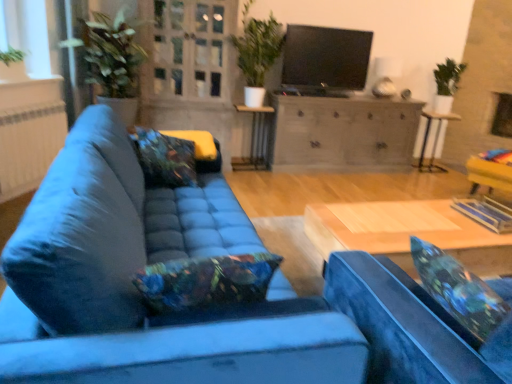
Locate an element on the screen. wooden cabinet at center is located at coordinates (342, 133).

Describe the element at coordinates (324, 61) in the screenshot. I see `matte black tv at upper center` at that location.

Describe the element at coordinates (490, 178) in the screenshot. Image resolution: width=512 pixels, height=384 pixels. I see `yellow fabric armchair at lower right, acting as the 1th armchair starting from the right` at that location.

This screenshot has height=384, width=512. What are the coordinates of `wooden cabinet at center` in the screenshot? It's located at (342, 133).

Does point (257, 136) come farther from viewer compared to point (373, 241)?

Yes, point (257, 136) is farther from viewer.

How different are the orientations of metallic silver side table at center and wooden coffee table at center in degrees?

They differ by 179 degrees in their facing directions.

Where is `table below the metallic silver side table at center (from a real-world perspective)`? This screenshot has height=384, width=512. table below the metallic silver side table at center (from a real-world perspective) is located at coordinates (407, 233).

Which object is further away from the camera, metallic silver side table at center or wooden coffee table at center?

metallic silver side table at center is more distant.

Is floral fabric pillow at lower right, the 1th pillow when ordered from right to left, at the right side of clear glass door at upper center?

Yes.

From the image's perspective, does floral fabric pillow at lower right, positioned as the second pillow in front-to-back order, appear lower than clear glass door at upper center?

Correct, floral fabric pillow at lower right, positioned as the second pillow in front-to-back order, appears lower than clear glass door at upper center in the image.

Is floral fabric pillow at lower right, positioned as the second pillow in front-to-back order, far from clear glass door at upper center?

Absolutely, floral fabric pillow at lower right, positioned as the second pillow in front-to-back order, is distant from clear glass door at upper center.

Considering the sizes of objects yellow fabric armchair at lower right, which appears as the second armchair when viewed from the left, and white textured radiator at left in the image provided, who is bigger, yellow fabric armchair at lower right, which appears as the second armchair when viewed from the left, or white textured radiator at left?

yellow fabric armchair at lower right, which appears as the second armchair when viewed from the left.

Is yellow fabric armchair at lower right, acting as the 1th armchair starting from the right, not near white textured radiator at left?

Yes.

Based on the photo, from the image's perspective, which one is positioned lower, yellow fabric armchair at lower right, which is the 1th armchair in top-to-bottom order, or white textured radiator at left?

yellow fabric armchair at lower right, which is the 1th armchair in top-to-bottom order, appears lower in the image.

Considering the positions of point (490, 192) and point (16, 195), is point (490, 192) closer or farther from the camera than point (16, 195)?

Point (490, 192) appears to be closer to the viewer than point (16, 195).

Which is in front, matte black tv at upper center or white glossy stool at right?

matte black tv at upper center is closer to the camera.

Is matte black tv at upper center turned away from white glossy stool at right?

matte black tv at upper center is not turned away from white glossy stool at right.

In the scene shown: Is matte black tv at upper center far from white glossy stool at right?

Yes, matte black tv at upper center and white glossy stool at right are located far from each other.

Are white glossy stool at right and floral fabric pillow at center, the second pillow positioned from the back, located far from each other?

Absolutely, white glossy stool at right is distant from floral fabric pillow at center, the second pillow positioned from the back.

The height and width of the screenshot is (384, 512). I want to click on stool that appears on the right of floral fabric pillow at center, the 1th pillow from the front, so click(x=434, y=140).

Is point (439, 114) closer to viewer compared to point (184, 154)?

That is False.

Can you confirm if white glossy stool at right is bigger than floral fabric pillow at center, the second pillow positioned from the back?

Yes.

Between floral fabric pillow at center, the second pillow positioned from the back, and velvet blue armchair at lower right, which appears as the first armchair when viewed from the left, which one is positioned in front?

velvet blue armchair at lower right, which appears as the first armchair when viewed from the left, is closer to the camera.

Is floral fabric pillow at center, marked as the first pillow in a left-to-right arrangement, situated inside velvet blue armchair at lower right, which is the first armchair in bottom-to-top order, or outside?

floral fabric pillow at center, marked as the first pillow in a left-to-right arrangement, exists outside the volume of velvet blue armchair at lower right, which is the first armchair in bottom-to-top order.

Between floral fabric pillow at center, marked as the first pillow in a left-to-right arrangement, and velvet blue armchair at lower right, which appears as the first armchair when viewed from the left, which one has larger width?

floral fabric pillow at center, marked as the first pillow in a left-to-right arrangement.

Is floral fabric pillow at center, the 1th pillow from the front, further to camera compared to green matte plant at upper center?

No, floral fabric pillow at center, the 1th pillow from the front, is in front of green matte plant at upper center.

From the image's perspective, is floral fabric pillow at center, the 1th pillow from the front, beneath green matte plant at upper center?

Indeed, from the image's perspective, floral fabric pillow at center, the 1th pillow from the front, is shown beneath green matte plant at upper center.

Between floral fabric pillow at center, marked as the first pillow in a left-to-right arrangement, and green matte plant at upper center, which one appears on the right side from the viewer's perspective?

From the viewer's perspective, green matte plant at upper center appears more on the right side.

Can you tell me how much floral fabric pillow at center, the 1th pillow from the front, and green matte plant at upper center differ in facing direction?

floral fabric pillow at center, the 1th pillow from the front, and green matte plant at upper center are facing 3.58 degrees away from each other.

What are the coordinates of `side table behind the wooden coffee table at center` in the screenshot? It's located at (255, 139).

The width and height of the screenshot is (512, 384). Find the location of `glass door located on the left of floral fabric pillow at lower right, placed as the first pillow when sorted from back to front`. glass door located on the left of floral fabric pillow at lower right, placed as the first pillow when sorted from back to front is located at coordinates (192, 49).

Which object lies further to the anchor point white matte window screen at upper left, metallic silver side table at center or velvet blue couch at center?

velvet blue couch at center is positioned further to the anchor white matte window screen at upper left.

Looking at the image, which one is located further to white glossy stool at right, white matte window screen at upper left or velvet blue armchair at lower right, acting as the 1th armchair starting from the front?

velvet blue armchair at lower right, acting as the 1th armchair starting from the front.

Which object lies nearer to the anchor point white glossy stool at right, velvet blue couch at center or velvet blue armchair at lower right, marked as the second armchair in a top-to-bottom arrangement?

The object closer to white glossy stool at right is velvet blue couch at center.

Based on their spatial positions, is green matte plant at upper center or metallic silver side table at center further from matte black tv at upper center?

metallic silver side table at center is further to matte black tv at upper center.

When comparing their distances from floral fabric pillow at lower right, positioned as the second pillow in front-to-back order, does metallic silver side table at center or wooden coffee table at center seem closer?

wooden coffee table at center lies closer to floral fabric pillow at lower right, positioned as the second pillow in front-to-back order, than the other object.

When comparing their distances from yellow fabric armchair at lower right, arranged as the first armchair when viewed from the back, does wooden cabinet at center or white glossy stool at right seem further?

wooden cabinet at center.

Estimate the real-world distances between objects in this image. Which object is further from white glossy stool at right, white textured radiator at left or velvet blue couch at center?

white textured radiator at left is further to white glossy stool at right.

Looking at the image, which one is located closer to metallic silver side table at center, floral fabric pillow at center, marked as the first pillow in a left-to-right arrangement, or velvet blue armchair at lower right, which appears as the first armchair when viewed from the left?

Among the two, floral fabric pillow at center, marked as the first pillow in a left-to-right arrangement, is located nearer to metallic silver side table at center.

Locate an element on the screen. This screenshot has height=384, width=512. plant between wooden coffee table at center and white glossy stool at right in the front-back direction is located at coordinates (257, 46).

Identify the location of radiator between white matte window screen at upper left and velvet blue armchair at lower right, acting as the 1th armchair starting from the front, from left to right. The height and width of the screenshot is (384, 512). (29, 145).

Identify the location of glass door between wooden coffee table at center and metallic silver side table at center in the front-back direction. (192, 49).

Find the location of `cabinetry between velvet blue armchair at lower right, which is the first armchair in bottom-to-top order, and metallic silver side table at center in the front-back direction`. cabinetry between velvet blue armchair at lower right, which is the first armchair in bottom-to-top order, and metallic silver side table at center in the front-back direction is located at coordinates tap(342, 133).